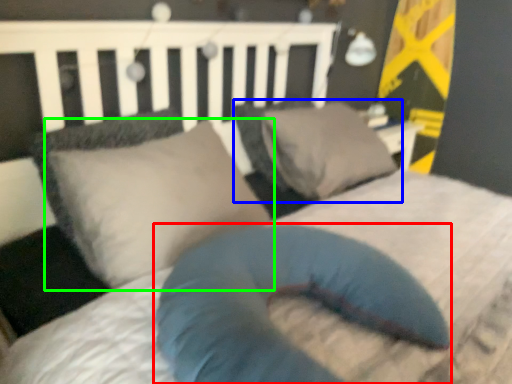
Question: Which object is positioned closest to pillow (highlighted by a red box)? Select from pillow (highlighted by a blue box) and pillow (highlighted by a green box).

Choices:
 (A) pillow
 (B) pillow

Answer: (B)